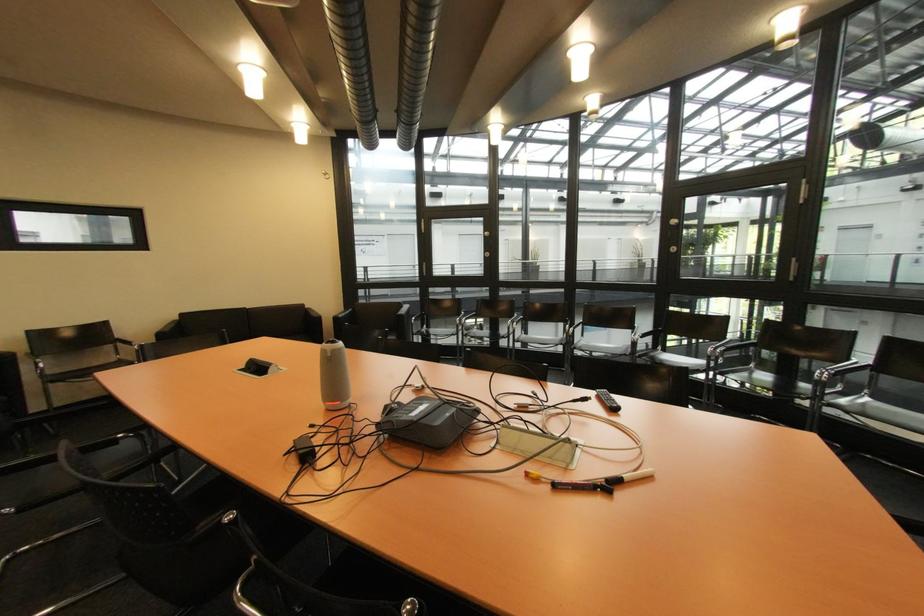
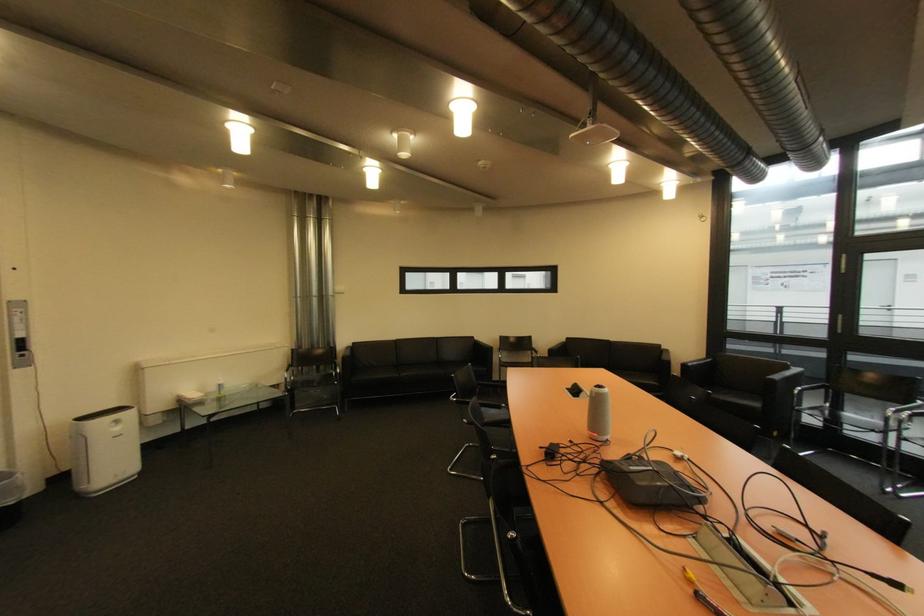
Locate, in the second image, the point that corresponds to [277,371] in the first image.

(590, 397)